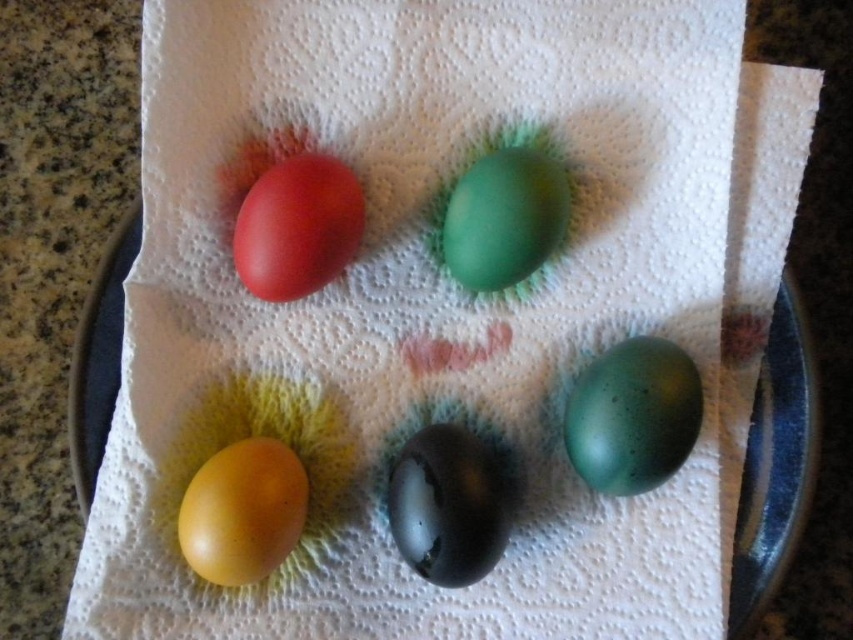
From the picture: Between matte red egg at upper left and green matte egg at center, which one appears on the left side from the viewer's perspective?

matte red egg at upper left

Which is above, matte red egg at upper left or green matte egg at center?

green matte egg at center is above.

Is point (262, 195) positioned in front of point (489, 273)?

Yes.

At what (x,y) coordinates should I click in order to perform the action: click on matte red egg at upper left. Please return your answer as a coordinate pair (x, y). Looking at the image, I should click on (297, 227).

Does point (253, 548) come behind point (480, 170)?

No, (253, 548) is closer to viewer.

Based on the photo, between yellow matte egg at lower left and green matte egg at center, which one is positioned lower?

yellow matte egg at lower left is below.

Is point (247, 483) closer to viewer compared to point (537, 168)?

That is True.

Identify the location of yellow matte egg at lower left. Image resolution: width=853 pixels, height=640 pixels. (242, 512).

Between matte red egg at upper left and yellow matte egg at lower left, which one appears on the right side from the viewer's perspective?

matte red egg at upper left is more to the right.

Between point (236, 224) and point (242, 460), which one is positioned behind?

Point (236, 224)

Locate an element on the screen. The image size is (853, 640). matte red egg at upper left is located at coordinates (297, 227).